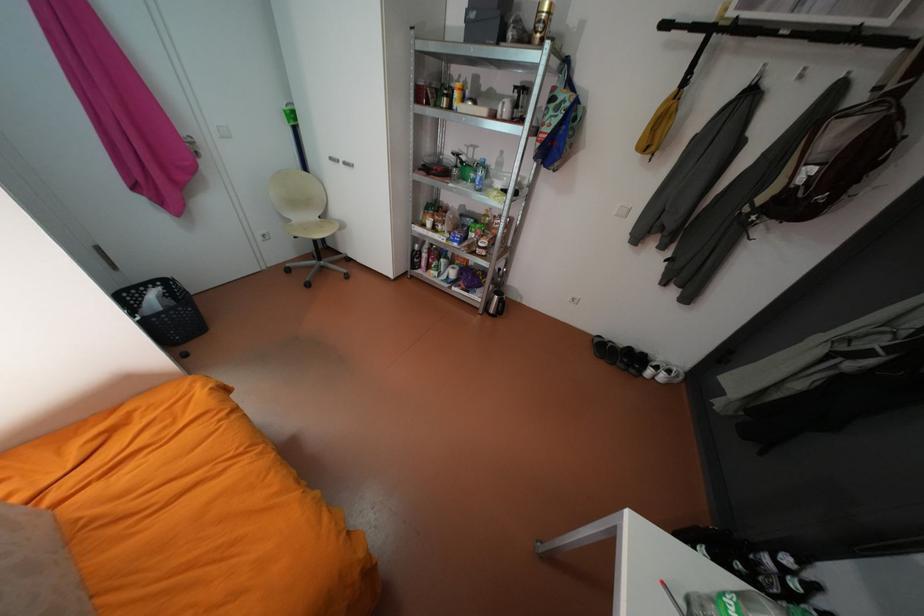
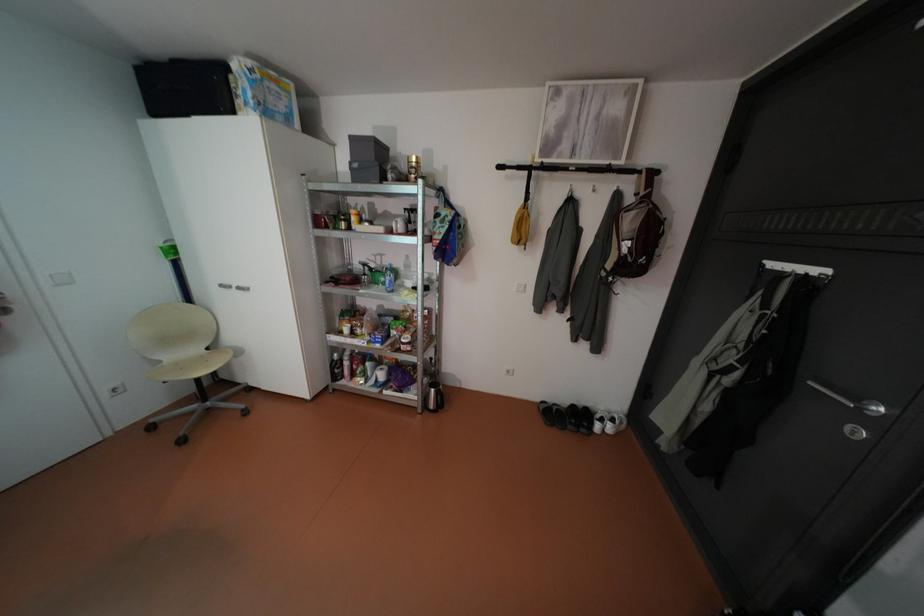
Where in the second image is the point corresponding to the point at 355,163 from the first image?

(248, 286)